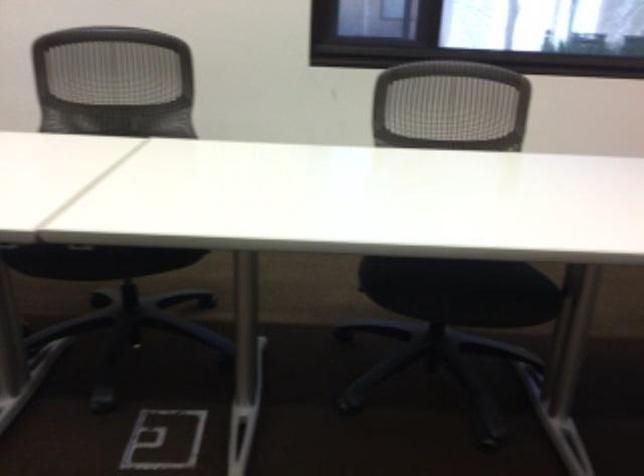
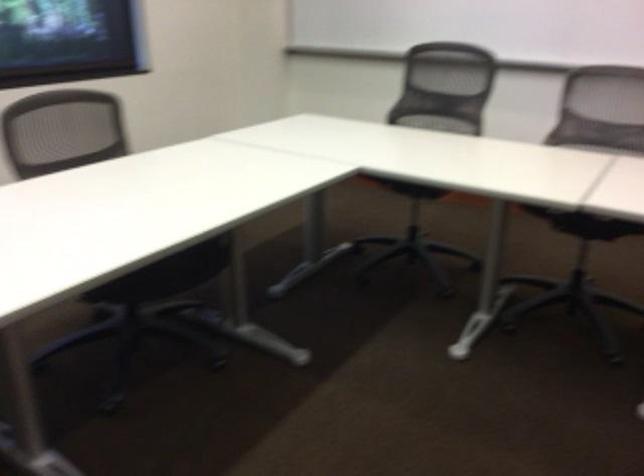
In the second image, find the point that corresponds to (x=444, y=299) in the first image.

(166, 275)